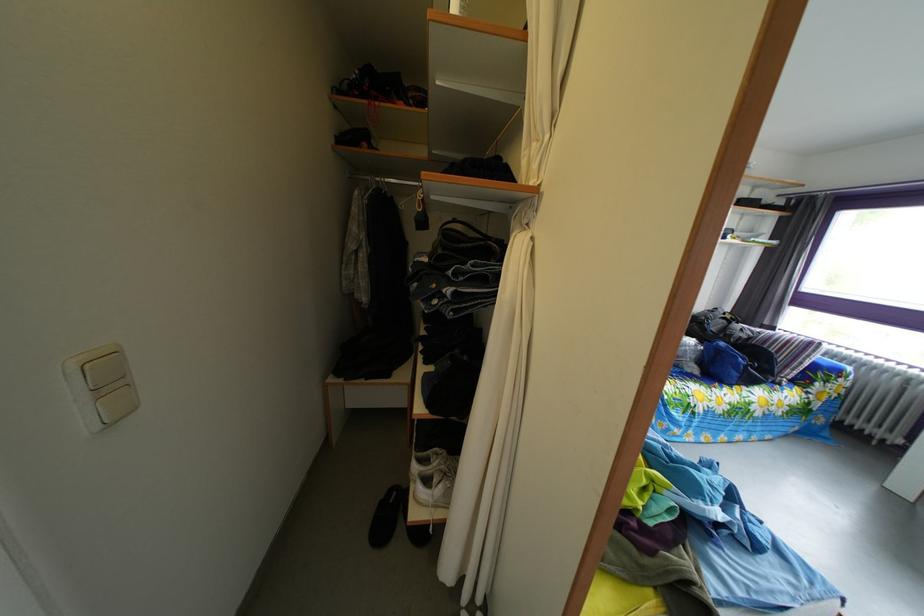
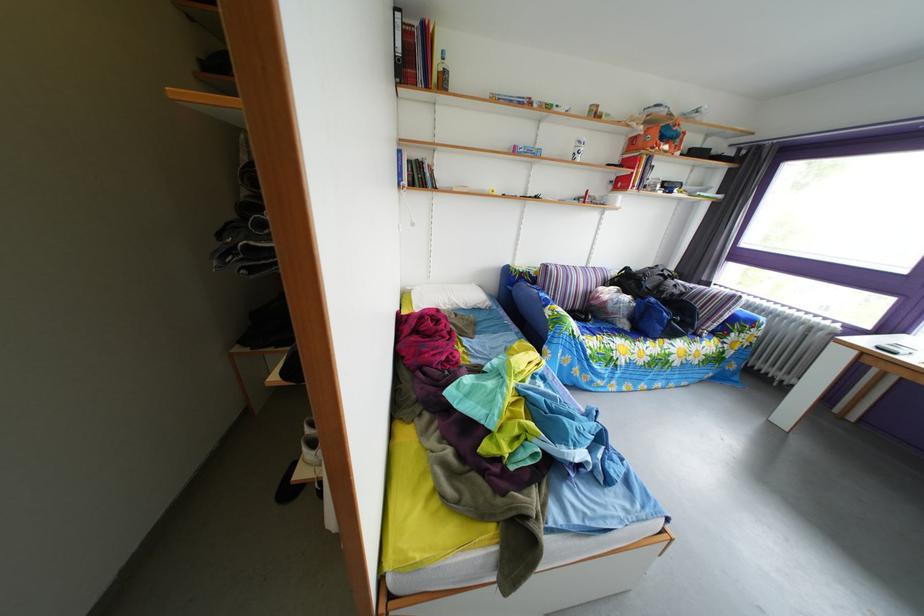
Question: What movement of the cameraman would produce the second image?

Choices:
 (A) Left
 (B) Right
 (C) Forward
 (D) Backward

Answer: (B)